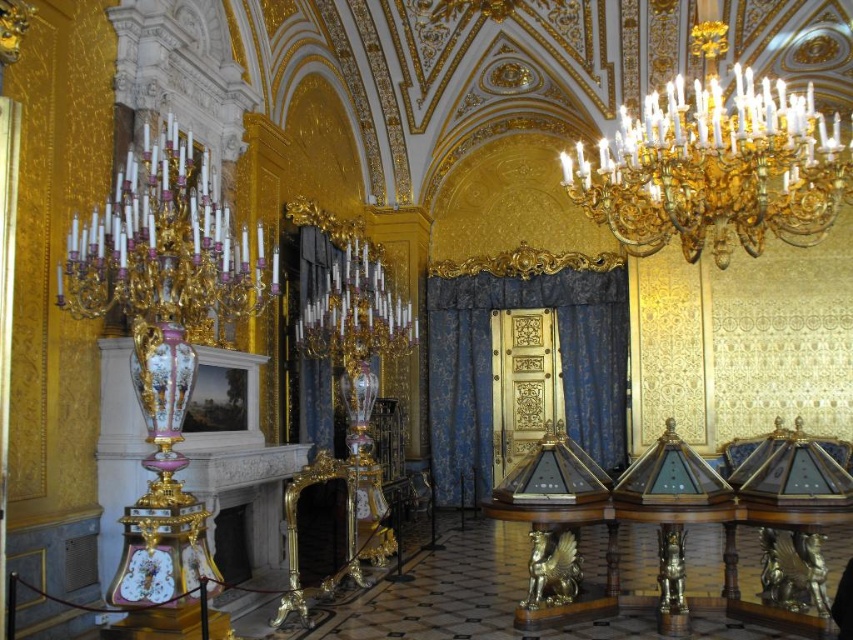
Question: Can you confirm if gold/gilded/candleholder at upper left is positioned above black velvet curtain at center?

Choices:
 (A) yes
 (B) no

Answer: (A)

Question: Which of the following is the farthest from the observer?

Choices:
 (A) black velvet curtain at center
 (B) gold/gilded metal chandelier at upper right
 (C) gold/gilded/candleholder at upper left

Answer: (A)

Question: Which of the following is the closest to the observer?

Choices:
 (A) gold/gilded metal chandelier at upper right
 (B) gold/gilded/candleholder at upper left
 (C) black velvet curtain at center
 (D) blue velvet curtain at center

Answer: (B)

Question: Is blue velvet curtain at center closer to camera compared to black velvet curtain at center?

Choices:
 (A) yes
 (B) no

Answer: (B)

Question: Can you confirm if blue velvet curtain at center is thinner than black velvet curtain at center?

Choices:
 (A) yes
 (B) no

Answer: (B)

Question: Which point is farther from the camera taking this photo?

Choices:
 (A) (741, 99)
 (B) (457, 445)
 (C) (144, 282)

Answer: (B)